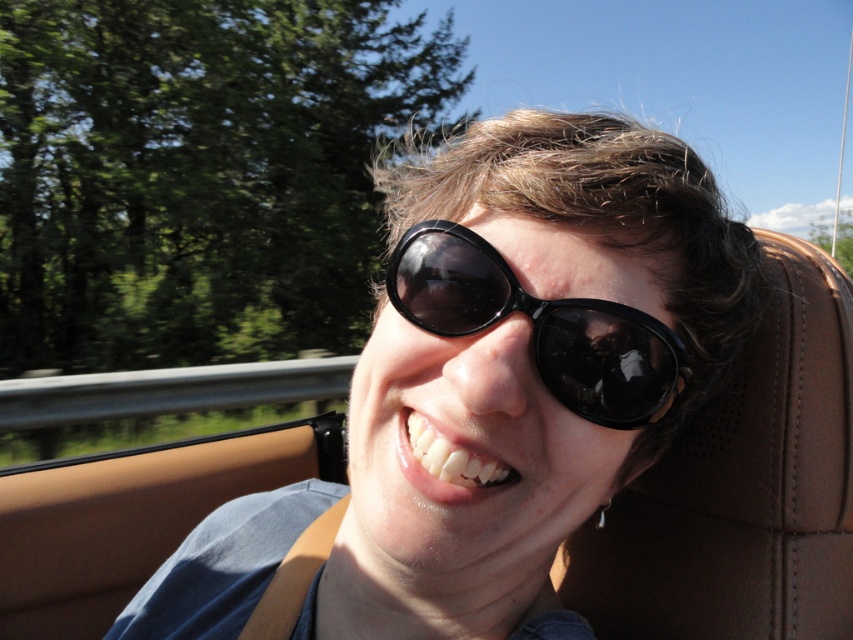
Can you confirm if matte black sunglasses at center is thinner than black glossy sunglasses at center?

No, matte black sunglasses at center is not thinner than black glossy sunglasses at center.

Is matte black sunglasses at center smaller than black glossy sunglasses at center?

Incorrect, matte black sunglasses at center is not smaller in size than black glossy sunglasses at center.

Between point (488, 556) and point (563, 346), which one is positioned behind?

Positioned behind is point (488, 556).

The height and width of the screenshot is (640, 853). Identify the location of matte black sunglasses at center. (526, 365).

Between matte black sunglasses at center and white glossy teeth at center, which one has more height?

Standing taller between the two is matte black sunglasses at center.

Does matte black sunglasses at center have a greater height compared to white glossy teeth at center?

Correct, matte black sunglasses at center is much taller as white glossy teeth at center.

Is point (558, 496) positioned after point (408, 429)?

Yes, it is behind point (408, 429).

Locate an element on the screen. matte black sunglasses at center is located at coordinates (526, 365).

Does black glossy sunglasses at center have a greater width compared to white glossy teeth at center?

Correct, the width of black glossy sunglasses at center exceeds that of white glossy teeth at center.

Which is in front, point (468, 266) or point (486, 484)?

Point (486, 484)

Is point (431, 333) behind point (440, 477)?

That is True.

You are a GUI agent. You are given a task and a screenshot of the screen. Output one action in this format:
    pyautogui.click(x=<x>, y=<y>)
    Task: Click on the black glossy sunglasses at center
    The image size is (853, 640).
    Given the screenshot: What is the action you would take?
    pyautogui.click(x=540, y=324)